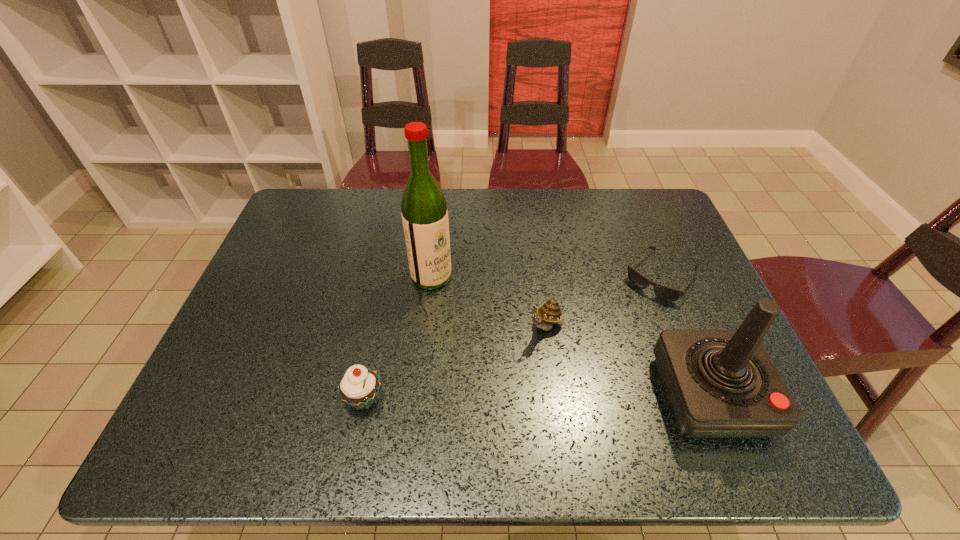
The image size is (960, 540). In order to click on cupcake in this screenshot , I will do `click(359, 387)`.

The width and height of the screenshot is (960, 540). I want to click on joystick, so coord(719,383).

Where is `the third object from left to right`? The height and width of the screenshot is (540, 960). the third object from left to right is located at coordinates (550, 313).

Find the location of a particular element. This screenshot has height=540, width=960. the third farthest object is located at coordinates (550, 313).

Identify the location of sunglasses. The height and width of the screenshot is (540, 960). (663, 292).

The image size is (960, 540). I want to click on the tallest object, so click(424, 213).

Identify the location of the fourth object from right to left. pos(424,213).

Where is `free space located on the left of the leftmost object`? free space located on the left of the leftmost object is located at coordinates (209, 400).

Locate an element on the screen. free space located 0.180m on the face of the third object from left to right is located at coordinates (495, 397).

Identify the location of blank area located 0.220m on the face of the third object from left to right. (485, 411).